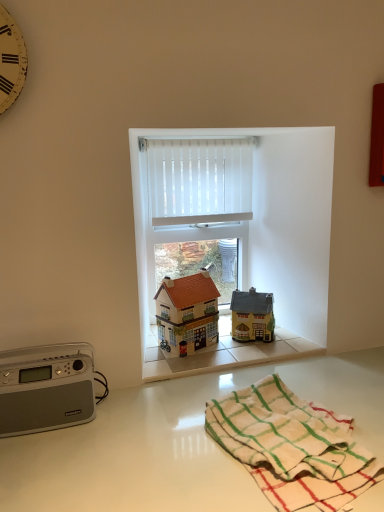
Question: Is matte brown house at center, the 2th toy from the right, in front of or behind white glossy countertop at lower center in the image?

Choices:
 (A) behind
 (B) front

Answer: (A)

Question: Is matte brown house at center, the 2th toy from the right, inside the boundaries of white glossy countertop at lower center, or outside?

Choices:
 (A) outside
 (B) inside

Answer: (A)

Question: Which object is positioned farthest from the white glossy countertop at lower center?

Choices:
 (A) white vertical blinds at center
 (B) matte brown house at center, which ranks as the 1th toy in left-to-right order
 (C) silver metallic radio at left
 (D) matte yellow house at center, the second toy viewed from the left
 (E) white cotton towel at lower right

Answer: (A)

Question: Which is nearer to the silver metallic radio at left?

Choices:
 (A) white vertical blinds at center
 (B) matte yellow house at center, the 1th toy when ordered from right to left
 (C) white glossy countertop at lower center
 (D) matte brown house at center, which ranks as the 1th toy in left-to-right order
 (E) white cotton towel at lower right

Answer: (C)